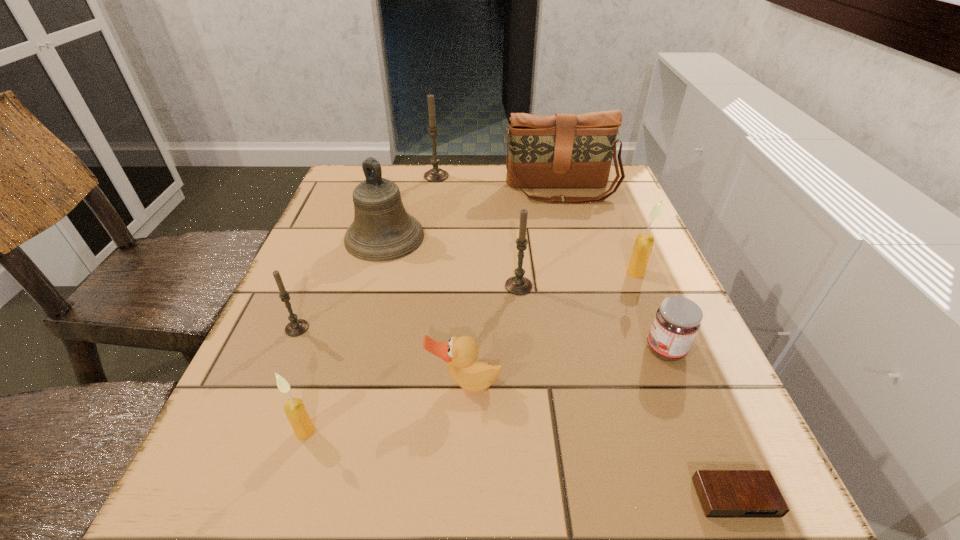
Locate an element on the screen. The width and height of the screenshot is (960, 540). the second gray candle from right to left is located at coordinates (435, 174).

Locate an element on the screen. the farthest gray candle is located at coordinates pos(435,174).

The image size is (960, 540). I want to click on shoulder bag, so click(x=564, y=150).

Locate an element on the screen. bell is located at coordinates (382, 230).

Identify the location of the right cream candle. (643, 245).

Locate an element on the screen. The image size is (960, 540). the rightmost candle is located at coordinates (643, 245).

At what (x,y) coordinates should I click in order to perform the action: click on the second farthest gray candle. Please return your answer as a coordinate pair (x, y). The image size is (960, 540). Looking at the image, I should click on (518, 285).

You are a GUI agent. You are given a task and a screenshot of the screen. Output one action in this format:
    pyautogui.click(x=<x>, y=<y>)
    Task: Click on the fourth candle from left to right
    
    Given the screenshot: What is the action you would take?
    pyautogui.click(x=518, y=285)

Where is `the nearest gray candle`? the nearest gray candle is located at coordinates (296, 327).

Identify the location of the fourth farthest candle. This screenshot has width=960, height=540. (296, 327).